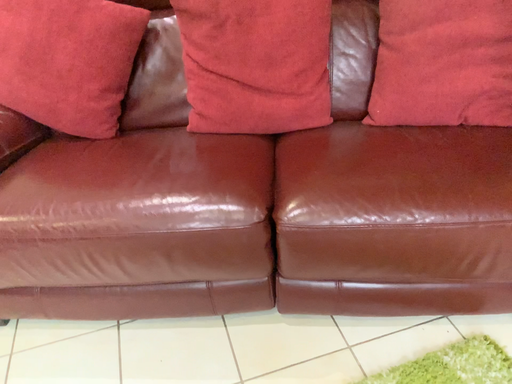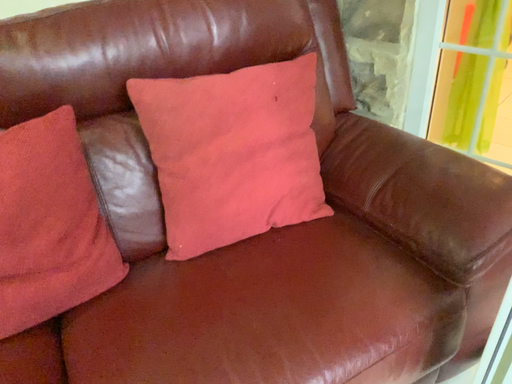
Question: Which way did the camera rotate in the video?

Choices:
 (A) rotated right
 (B) rotated left

Answer: (A)